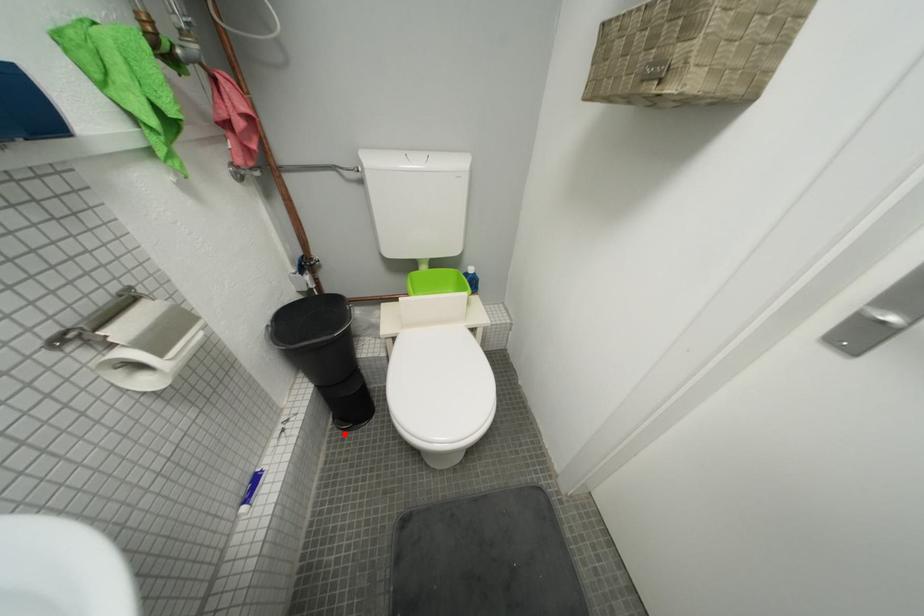
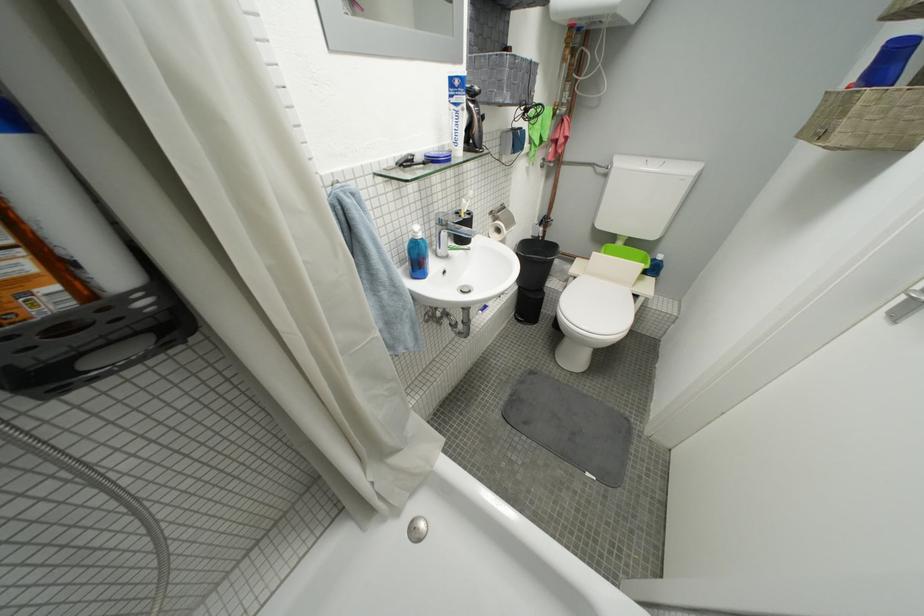
Where in the second image is the point corresponding to the highlighted location from the first image?

(523, 322)